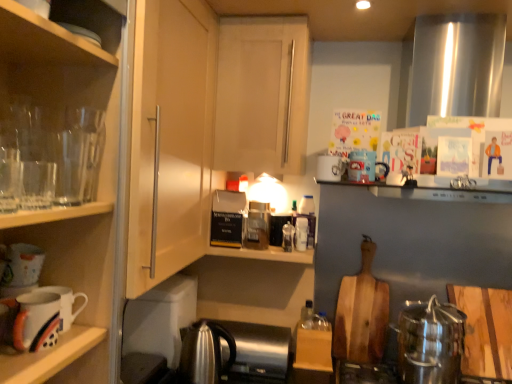
What do you see at coordinates (362, 313) in the screenshot? I see `wooden cutting board at center-right, positioned as the 1th cutting board in left-to-right order` at bounding box center [362, 313].

What do you see at coordinates (259, 351) in the screenshot? I see `satin silver kettle at lower center` at bounding box center [259, 351].

The image size is (512, 384). Describe the element at coordinates (67, 169) in the screenshot. I see `transparent glass cabinet at left, marked as the 2th cabinetry in a back-to-front arrangement` at that location.

What do you see at coordinates (204, 353) in the screenshot? The height and width of the screenshot is (384, 512). I see `satin silver kettle at lower center` at bounding box center [204, 353].

Locate an element on the screen. matte white mug at lower left, which ranks as the first mug in front-to-back order is located at coordinates (36, 321).

Find the location of `satin silver kettle at lower right`. satin silver kettle at lower right is located at coordinates (430, 342).

Image resolution: width=512 pixels, height=384 pixels. In order to click on wooden cutting board at center-right, acting as the 2th cutting board starting from the right in this screenshot , I will do `click(362, 313)`.

Which is more distant, (54, 114) or (194, 350)?

The point (194, 350) is more distant.

Are transparent glassware at left and satin silver kettle at lower center beside each other?

There is a gap between transparent glassware at left and satin silver kettle at lower center.

Is the position of transparent glassware at left more distant than that of satin silver kettle at lower center?

No, transparent glassware at left is in front of satin silver kettle at lower center.

Based on the photo, would you say translucent plastic bottle at shelf center, marked as the 1th bottle in a left-to-right arrangement, is part of satin silver kettle at lower center's contents?

Actually, translucent plastic bottle at shelf center, marked as the 1th bottle in a left-to-right arrangement, is outside satin silver kettle at lower center.

How far apart are satin silver kettle at lower center and translucent plastic bottle at shelf center, placed as the first bottle when sorted from front to back?

The distance of satin silver kettle at lower center from translucent plastic bottle at shelf center, placed as the first bottle when sorted from front to back, is 19.57 inches.

Is satin silver kettle at lower center not close to translucent plastic bottle at shelf center, marked as the second bottle in a back-to-front arrangement?

No, satin silver kettle at lower center is in close proximity to translucent plastic bottle at shelf center, marked as the second bottle in a back-to-front arrangement.

How many degrees apart are the facing directions of satin silver kettle at lower center and translucent plastic bottle at shelf center, positioned as the 2th bottle in right-to-left order?

They differ by 0.00141 degrees in their facing directions.

Between satin silver kettle at lower right and wooden cutting board at center-right, positioned as the 1th cutting board in left-to-right order, which one has smaller width?

With smaller width is wooden cutting board at center-right, positioned as the 1th cutting board in left-to-right order.

From a real-world perspective, starting from the satin silver kettle at lower right, which cutting board is the 2nd one vertically above it? Please provide its 2D coordinates.

[(362, 313)]

From a real-world perspective, which is physically above, satin silver kettle at lower right or wooden cutting board at center-right, positioned as the 1th cutting board in left-to-right order?

wooden cutting board at center-right, positioned as the 1th cutting board in left-to-right order.

Between satin silver kettle at lower right and wooden cutting board at center-right, which ranks as the first cutting board in back-to-front order, which one appears on the left side from the viewer's perspective?

wooden cutting board at center-right, which ranks as the first cutting board in back-to-front order.

Is satin silver kettle at lower center smaller than transparent glass cabinet at left, marked as the 2th cabinetry in a back-to-front arrangement?

Indeed, satin silver kettle at lower center has a smaller size compared to transparent glass cabinet at left, marked as the 2th cabinetry in a back-to-front arrangement.

There is a satin silver kettle at lower center. Identify the location of the 1st cabinetry above it (from a real-world perspective). (67, 169).

From a real-world perspective, is satin silver kettle at lower center above or below transparent glass cabinet at left, marked as the 2th cabinetry in a back-to-front arrangement?

In terms of real-world spatial position, satin silver kettle at lower center is below transparent glass cabinet at left, marked as the 2th cabinetry in a back-to-front arrangement.

In terms of height, does satin silver kettle at lower center look taller or shorter compared to transparent glass cabinet at left, marked as the 2th cabinetry in a back-to-front arrangement?

In the image, satin silver kettle at lower center appears to be shorter than transparent glass cabinet at left, marked as the 2th cabinetry in a back-to-front arrangement.

Is transparent glass cabinet at left, which is the first cabinetry in left-to-right order, to the left of wooden cutting board at lower right, arranged as the first cutting board when viewed from the front, from the viewer's perspective?

Yes, transparent glass cabinet at left, which is the first cabinetry in left-to-right order, is to the left of wooden cutting board at lower right, arranged as the first cutting board when viewed from the front.

Which of these two, transparent glass cabinet at left, marked as the 2th cabinetry in a back-to-front arrangement, or wooden cutting board at lower right, marked as the first cutting board in a right-to-left arrangement, is smaller?

Smaller between the two is wooden cutting board at lower right, marked as the first cutting board in a right-to-left arrangement.

Looking at their sizes, would you say transparent glass cabinet at left, arranged as the 2th cabinetry when viewed from the right, is wider or thinner than wooden cutting board at lower right, which ranks as the second cutting board in left-to-right order?

In the image, transparent glass cabinet at left, arranged as the 2th cabinetry when viewed from the right, appears to be wider than wooden cutting board at lower right, which ranks as the second cutting board in left-to-right order.

Which is less distant, (38, 149) or (492, 310)?

Point (38, 149)

Is translucent plastic bottle at shelf center, marked as the second bottle in a back-to-front arrangement, closer to the viewer compared to transparent glassware at left?

No, it is not.

Consider the image. Is translucent plastic bottle at shelf center, marked as the 1th bottle in a left-to-right arrangement, outside of transparent glassware at left?

Yes.

Looking at the image, does translucent plastic bottle at shelf center, positioned as the 2th bottle in right-to-left order, seem bigger or smaller compared to transparent glassware at left?

translucent plastic bottle at shelf center, positioned as the 2th bottle in right-to-left order, is smaller than transparent glassware at left.

Which is more to the left, translucent plastic bottle at shelf center, marked as the 1th bottle in a left-to-right arrangement, or transparent glassware at left?

transparent glassware at left is more to the left.

From a real-world perspective, is satin silver kettle at lower right under white glossy mug at lower left, the 1th mug in the bottom-to-top sequence?

Correct, in the physical world, satin silver kettle at lower right is lower than white glossy mug at lower left, the 1th mug in the bottom-to-top sequence.

At what (x,y) coordinates should I click in order to perform the action: click on kitchen appliance below the white glossy mug at lower left, positioned as the second mug in left-to-right order (from a real-world perspective). Please return your answer as a coordinate pair (x, y). Image resolution: width=512 pixels, height=384 pixels. Looking at the image, I should click on (430, 342).

Is satin silver kettle at lower right inside the boundaries of white glossy mug at lower left, which is the second mug in right-to-left order, or outside?

satin silver kettle at lower right is spatially situated outside white glossy mug at lower left, which is the second mug in right-to-left order.

Considering the relative sizes of satin silver kettle at lower right and white glossy mug at lower left, the 3th mug from the top, in the image provided, is satin silver kettle at lower right smaller than white glossy mug at lower left, the 3th mug from the top,?

Incorrect, satin silver kettle at lower right is not smaller in size than white glossy mug at lower left, the 3th mug from the top.

What are the coordinates of `tea pot located underneath the transparent glassware at left (from a real-world perspective)` in the screenshot? It's located at (204, 353).

Where is `tea pot on the left of translucent plastic bottle at shelf center, positioned as the 2th bottle in right-to-left order`? The width and height of the screenshot is (512, 384). tea pot on the left of translucent plastic bottle at shelf center, positioned as the 2th bottle in right-to-left order is located at coordinates (204, 353).

Estimate the real-world distances between objects in this image. Which object is closer to wooden cutting board at center-right, which ranks as the first cutting board in back-to-front order, translucent plastic bottle at shelf center, placed as the first bottle when sorted from front to back, or translucent plastic bottle at center, marked as the 1th bottle in a back-to-front arrangement?

Among the two, translucent plastic bottle at center, marked as the 1th bottle in a back-to-front arrangement, is located nearer to wooden cutting board at center-right, which ranks as the first cutting board in back-to-front order.

Estimate the real-world distances between objects in this image. Which object is further from matte white mug at lower left, the second mug in the top-to-bottom sequence, satin silver kettle at lower center or satin silver kettle at lower right?

Based on the image, satin silver kettle at lower right appears to be further to matte white mug at lower left, the second mug in the top-to-bottom sequence.

From the image, which object appears to be nearer to white matte cabinet door at center, which is counted as the 2th cabinetry, starting from the left, translucent plastic bottle at center, marked as the 1th bottle in a back-to-front arrangement, or translucent plastic bottle at shelf center, marked as the 1th bottle in a left-to-right arrangement?

translucent plastic bottle at center, marked as the 1th bottle in a back-to-front arrangement, is closer to white matte cabinet door at center, which is counted as the 2th cabinetry, starting from the left.

When comparing their distances from wooden cutting board at center-right, positioned as the 1th cutting board in left-to-right order, does white glossy mug at lower left, which is counted as the second mug, starting from the front, or white glossy mug at upper center, positioned as the third mug in front-to-back order, seem further?

white glossy mug at lower left, which is counted as the second mug, starting from the front, lies further to wooden cutting board at center-right, positioned as the 1th cutting board in left-to-right order, than the other object.

From the image, which object appears to be nearer to translucent plastic bottle at center, which is counted as the 2th bottle, starting from the front, satin silver kettle at lower center or satin silver kettle at lower center?

Based on the image, satin silver kettle at lower center appears to be nearer to translucent plastic bottle at center, which is counted as the 2th bottle, starting from the front.

In the scene shown: When comparing their distances from transparent glass cabinet at left, which ranks as the 1th cabinetry in front-to-back order, does satin silver kettle at lower center or white glossy mug at upper center, which is the first mug from top to bottom, seem closer?

white glossy mug at upper center, which is the first mug from top to bottom.

When comparing their distances from white glossy mug at lower left, the 1th mug in the bottom-to-top sequence, does matte white mug at lower left, positioned as the 2th mug in bottom-to-top order, or satin silver kettle at lower right seem closer?

Among the two, matte white mug at lower left, positioned as the 2th mug in bottom-to-top order, is located nearer to white glossy mug at lower left, the 1th mug in the bottom-to-top sequence.

Looking at the image, which one is located closer to satin silver kettle at lower right, translucent plastic bottle at shelf center, positioned as the 2th bottle in right-to-left order, or wooden cutting board at lower right, marked as the first cutting board in a right-to-left arrangement?

Among the two, wooden cutting board at lower right, marked as the first cutting board in a right-to-left arrangement, is located nearer to satin silver kettle at lower right.

The height and width of the screenshot is (384, 512). I want to click on bottle located between transparent glass cabinet at left, which ranks as the 1th cabinetry in front-to-back order, and translucent plastic bottle at center, marked as the 1th bottle in a back-to-front arrangement, in the depth direction, so click(x=288, y=237).

Find the location of a particular element. The image size is (512, 384). bottle located between white glossy mug at upper center, which ranks as the 3th mug in bottom-to-top order, and translucent plastic bottle at center, arranged as the 1th bottle when viewed from the right, in the depth direction is located at coordinates (288, 237).

The height and width of the screenshot is (384, 512). Identify the location of cutting board between translucent plastic bottle at center, marked as the 1th bottle in a back-to-front arrangement, and wooden cutting board at lower right, arranged as the first cutting board when viewed from the front. (362, 313).

Where is `shelf between transparent glass cabinet at left, which ranks as the 1th cabinetry in front-to-back order, and wooden cutting board at lower right, the 2th cutting board positioned from the back, from left to right`? This screenshot has height=384, width=512. shelf between transparent glass cabinet at left, which ranks as the 1th cabinetry in front-to-back order, and wooden cutting board at lower right, the 2th cutting board positioned from the back, from left to right is located at coordinates (68, 100).